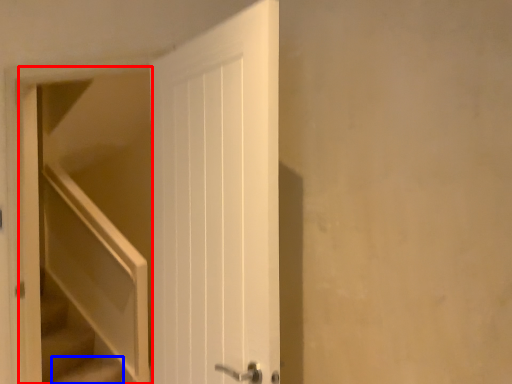
Question: Which of the following is the farthest to the observer, elevator (highlighted by a red box) or stairs (highlighted by a blue box)?

Choices:
 (A) elevator
 (B) stairs

Answer: (B)